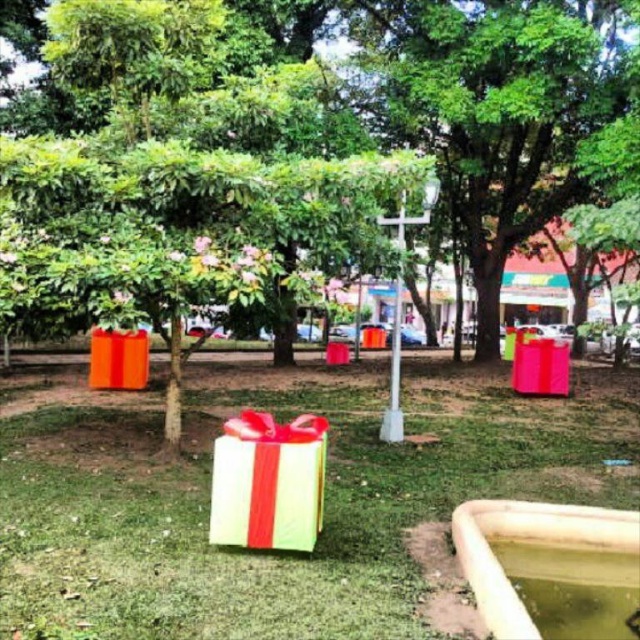
In the scene shown: You are standing at the edge of the park and see the matte orange gift at center and the green matte gift box at center. If you want to walk to both gifts, which one would you reach first if you walk straight ahead?

The matte orange gift at center and the green matte gift box at center are both at center, so you would reach them at the same time since they are equidistant from your starting position.